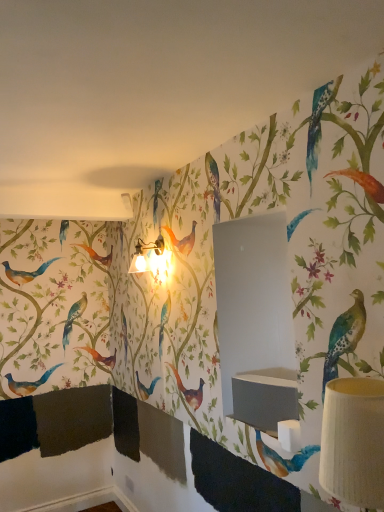
Question: Are matte gray sink at center and white textured lampshade at right, which is the 2th table lamp from left to right, located far from each other?

Choices:
 (A) yes
 (B) no

Answer: (B)

Question: Is matte gray sink at center at the left side of white textured lampshade at right, which ranks as the first table lamp in bottom-to-top order?

Choices:
 (A) yes
 (B) no

Answer: (A)

Question: Is matte gray sink at center wider than white textured lampshade at right, the 1th table lamp when ordered from front to back?

Choices:
 (A) yes
 (B) no

Answer: (B)

Question: Is the surface of matte gray sink at center in direct contact with white textured lampshade at right, which is the 2th table lamp from left to right?

Choices:
 (A) no
 (B) yes

Answer: (A)

Question: Can you confirm if matte gray sink at center is bigger than white textured lampshade at right, which ranks as the first table lamp in bottom-to-top order?

Choices:
 (A) yes
 (B) no

Answer: (B)

Question: Is white textured lampshade at right, the 1th table lamp when ordered from front to back, spatially inside metallic gold table lamp at upper center, the 2th table lamp in the right-to-left sequence, or outside of it?

Choices:
 (A) inside
 (B) outside

Answer: (B)

Question: From the image's perspective, is white textured lampshade at right, acting as the 2th table lamp starting from the back, positioned above or below metallic gold table lamp at upper center, the 2th table lamp in the front-to-back sequence?

Choices:
 (A) above
 (B) below

Answer: (B)

Question: Based on their positions, is white textured lampshade at right, the 1th table lamp viewed from the right, located to the left or right of metallic gold table lamp at upper center, which is the 1th table lamp in top-to-bottom order?

Choices:
 (A) left
 (B) right

Answer: (B)

Question: Looking at their shapes, would you say white textured lampshade at right, which ranks as the first table lamp in bottom-to-top order, is wider or thinner than metallic gold table lamp at upper center, which appears as the second table lamp when ordered from the bottom?

Choices:
 (A) wide
 (B) thin

Answer: (A)

Question: Based on their positions, is matte gray sink at center located to the left or right of white textured lampshade at right, the 1th table lamp when ordered from front to back?

Choices:
 (A) right
 (B) left

Answer: (B)

Question: Considering the positions of matte gray sink at center and white textured lampshade at right, the 1th table lamp when ordered from front to back, in the image, is matte gray sink at center bigger or smaller than white textured lampshade at right, the 1th table lamp when ordered from front to back,?

Choices:
 (A) small
 (B) big

Answer: (A)

Question: Is matte gray sink at center situated inside white textured lampshade at right, the second table lamp in the top-to-bottom sequence, or outside?

Choices:
 (A) outside
 (B) inside

Answer: (A)

Question: From a real-world perspective, is matte gray sink at center physically located above or below white textured lampshade at right, the second table lamp in the top-to-bottom sequence?

Choices:
 (A) below
 (B) above

Answer: (A)

Question: From a real-world perspective, is metallic gold table lamp at upper center, the 2th table lamp in the right-to-left sequence, above or below white textured lampshade at right, which is the 2th table lamp from left to right?

Choices:
 (A) above
 (B) below

Answer: (A)

Question: Considering the positions of metallic gold table lamp at upper center, acting as the first table lamp starting from the back, and white textured lampshade at right, acting as the 2th table lamp starting from the back, in the image, is metallic gold table lamp at upper center, acting as the first table lamp starting from the back, taller or shorter than white textured lampshade at right, acting as the 2th table lamp starting from the back,?

Choices:
 (A) tall
 (B) short

Answer: (B)